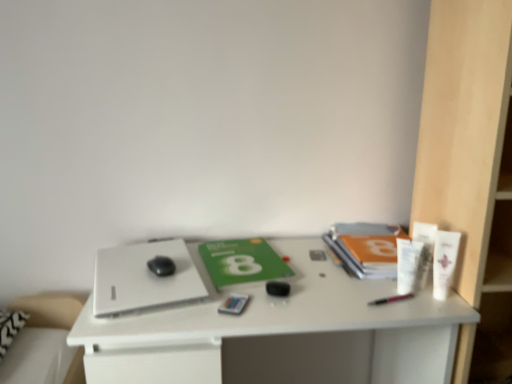
At what (x,y) coordinates should I click in order to perform the action: click on empty space that is in between orange matte book at right, arranged as the second paperback book when viewed from the left, and green matte paperback book at center, the second paperback book in the right-to-left sequence. Please return your answer as a coordinate pair (x, y). Looking at the image, I should click on (311, 267).